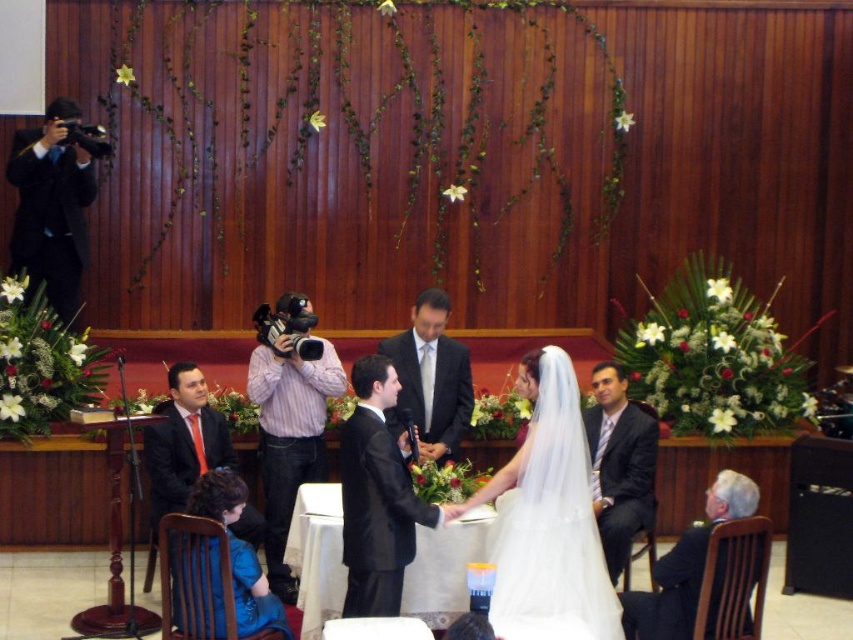
Question: Is pink striped shirt at center positioned in front of white cloth table at center?

Choices:
 (A) no
 (B) yes

Answer: (A)

Question: Can you confirm if white cloth table at center is positioned to the right of shiny black suit at center?

Choices:
 (A) yes
 (B) no

Answer: (B)

Question: Which is nearer to the matte black suit at left?

Choices:
 (A) white cloth table at center
 (B) dark gray suit at lower right

Answer: (A)

Question: Can you confirm if dark blue suit at right is thinner than shiny black suit at center?

Choices:
 (A) no
 (B) yes

Answer: (B)

Question: Which of the following is the closest to the observer?

Choices:
 (A) white cloth table at center
 (B) black satin suit at center

Answer: (B)

Question: Based on their relative distances, which object is nearer to the white cloth table at center?

Choices:
 (A) matte black suit at left
 (B) white sheer veil at center
 (C) shiny black suit at center

Answer: (C)